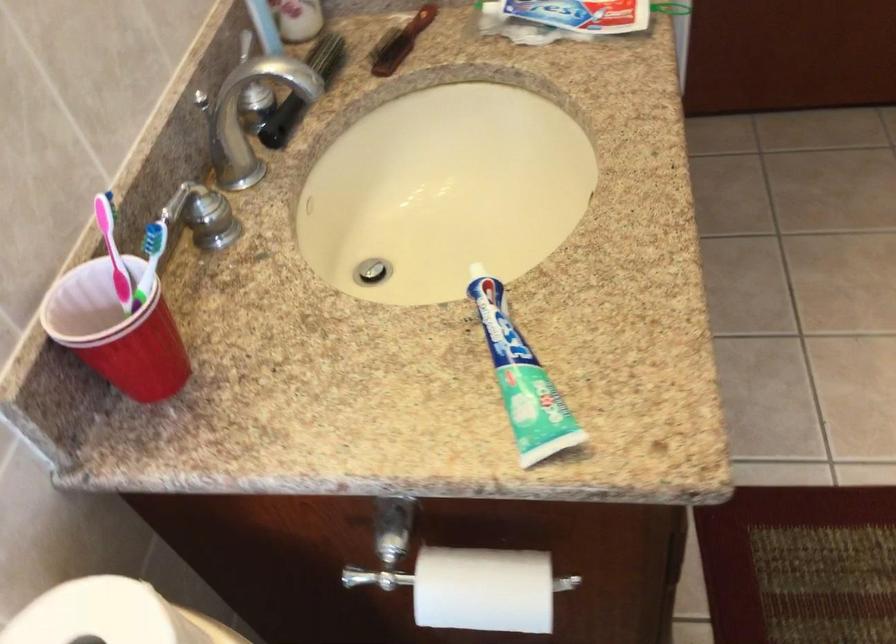
Where would you lift the brown handle brush? Please return your answer as a coordinate pair (x, y).

(400, 42)